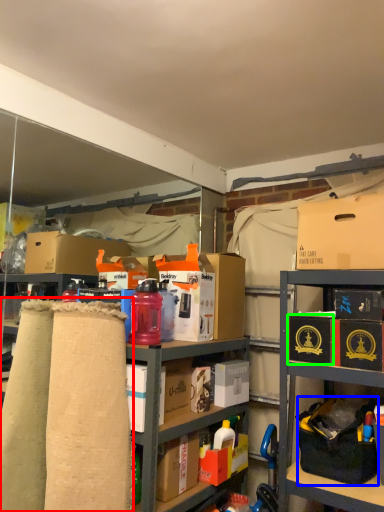
Question: Which is nearer to the fabric (highlighted by a red box)? handbag (highlighted by a blue box) or box (highlighted by a green box).

Choices:
 (A) handbag
 (B) box

Answer: (B)